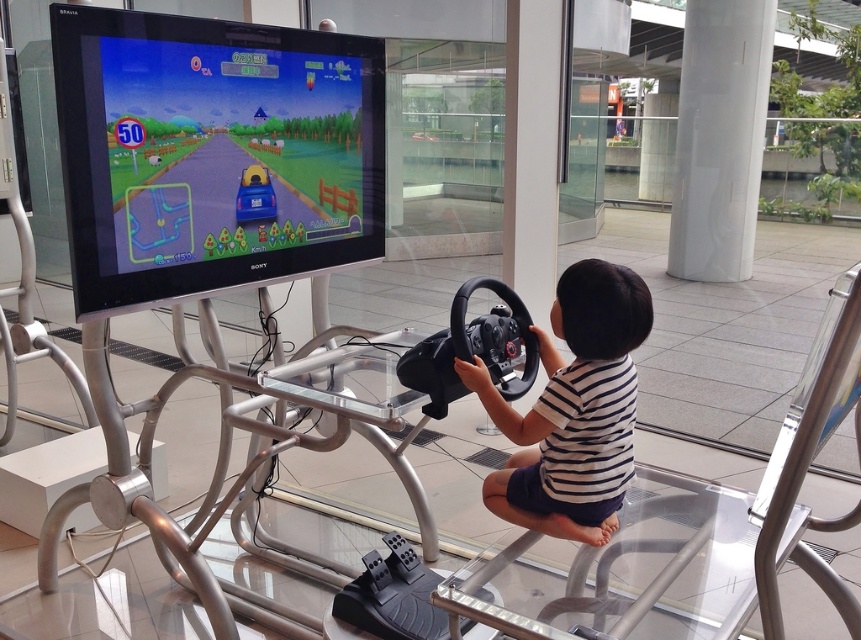
Looking at this image, you are a maintenance worker checking the distance between the white striped shirt at center and the white glossy pillar at upper right. According to safety regulations, the minimum distance required between interactive equipment and pillars must be at least 2 meters to prevent collisions. Is the current distance compliant with the safety regulations?

The distance between the white striped shirt at center and the white glossy pillar at upper right is 1.95 meters, which is less than the required 2 meters. Therefore, the setup does not comply with the safety regulations and needs adjustment.

You are a maintenance technician who needs to reach both the matte plastic screen at upper left and the white glossy pillar at upper right for inspection. The tools you carry are 6 feet long. Can you safely move the tools between these two objects without extending beyond the space?

The distance between the matte plastic screen at upper left and the white glossy pillar at upper right is 6.71 feet. Since the tools are 6 feet long, which is shorter than the distance between them, you can safely move the tools between these two objects without extending beyond the space.

You are a parent observing the child playing the driving game. The child wants to know if the steering wheel controller is closer to the matte plastic screen at upper left or the white glossy pillar at upper right. Based on the scene, which object is the steering wheel controller closer to?

The steering wheel controller is closer to the matte plastic screen at upper left because it is positioned to the left of the white glossy pillar at upper right.